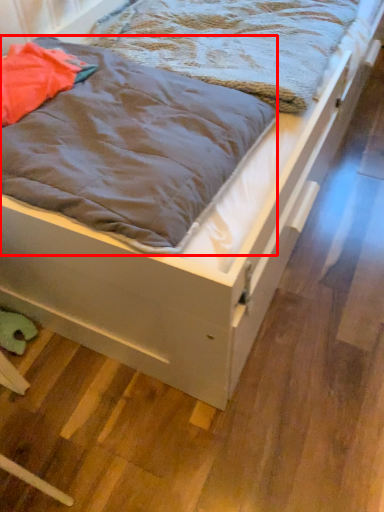
Question: From the image's perspective, where is blanket (annotated by the red box) located relative to blanket?

Choices:
 (A) above
 (B) below

Answer: (B)